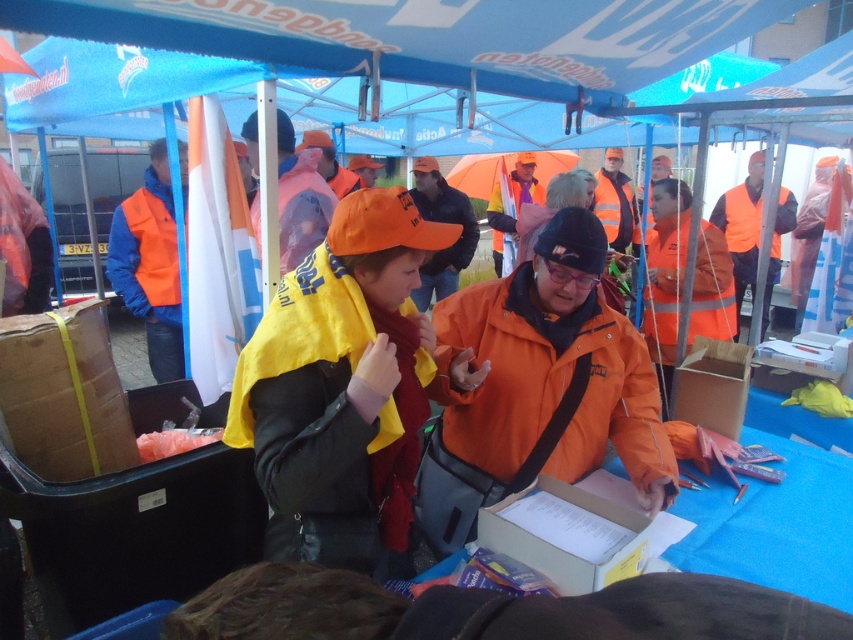
Question: Can you confirm if orange matte jacket at center is bigger than orange reflective jacket at center?

Choices:
 (A) yes
 (B) no

Answer: (B)

Question: Does orange reflective jacket at center have a greater width compared to cardboard box at lower right?

Choices:
 (A) no
 (B) yes

Answer: (B)

Question: Which point is farther from the camera taking this photo?

Choices:
 (A) (740, 195)
 (B) (259, 227)
 (C) (540, 516)
 (D) (712, 326)

Answer: (A)

Question: Considering the real-world distances, which object is farthest from the matte black jacket at center?

Choices:
 (A) orange matte jacket at center
 (B) orange reflective jacket at center
 (C) orange fabric cap at center
 (D) cardboard box at center

Answer: (C)

Question: Which object appears closest to the camera in this image?

Choices:
 (A) reflective orange vest at center
 (B) cardboard box at lower right
 (C) orange reflective life jacket at center
 (D) orange fabric cap at center

Answer: (B)

Question: Does cardboard box at center appear under reflective orange vest at center?

Choices:
 (A) no
 (B) yes

Answer: (B)